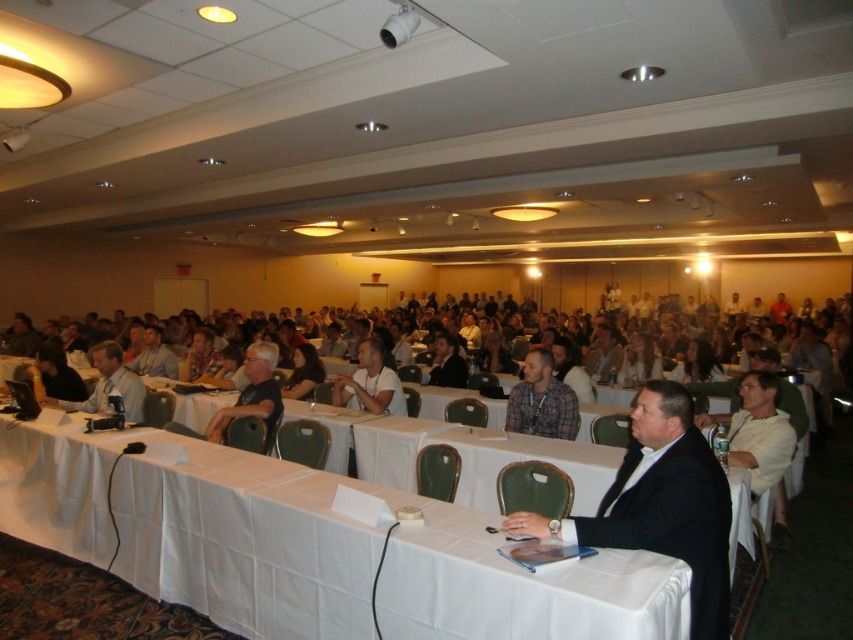
Locate an element on the screen. The height and width of the screenshot is (640, 853). matte black laptop at left is located at coordinates (109, 385).

Which of these two, matte black laptop at left or matte black shirt at lower left, stands taller?

matte black laptop at left

Does point (73, 403) lie behind point (138, 364)?

No, it is in front of (138, 364).

The height and width of the screenshot is (640, 853). I want to click on matte black laptop at left, so click(x=109, y=385).

Is white cloth at center positioned before black suit at center?

Yes, it is.

Who is taller, white cloth at center or black suit at center?

With more height is black suit at center.

Is point (312, 570) more distant than point (604, 500)?

Yes, it is behind point (604, 500).

Image resolution: width=853 pixels, height=640 pixels. What are the coordinates of `white cloth at center` in the screenshot? It's located at (308, 547).

Describe the element at coordinates (662, 502) in the screenshot. I see `black suit at center` at that location.

Is black suit at center in front of matte black shirt at lower left?

Yes, black suit at center is closer to the viewer.

At what (x,y) coordinates should I click in order to perform the action: click on black suit at center. Please return your answer as a coordinate pair (x, y). The image size is (853, 640). Looking at the image, I should click on (662, 502).

Identify the location of black suit at center. The image size is (853, 640). (662, 502).